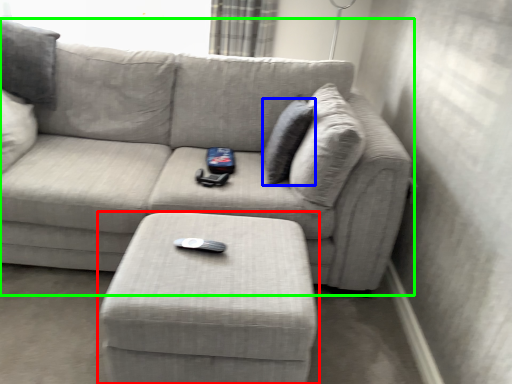
Question: Which is farther away from table (highlighted by a red box)? pillow (highlighted by a blue box) or studio couch (highlighted by a green box)?

Choices:
 (A) pillow
 (B) studio couch

Answer: (A)